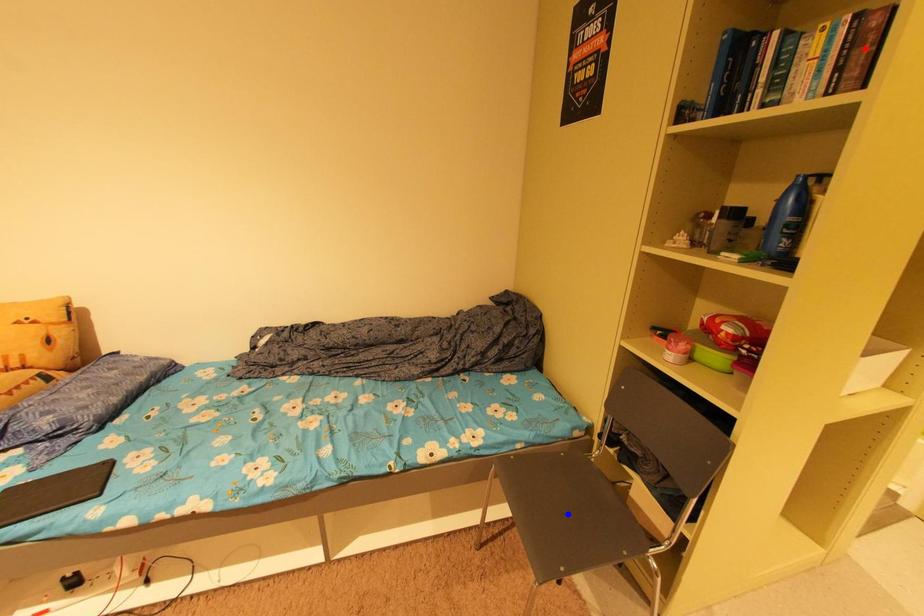
Question: Which of the two points in the image is closer to the camera?

Choices:
 (A) Blue point is closer.
 (B) Red point is closer.

Answer: (B)